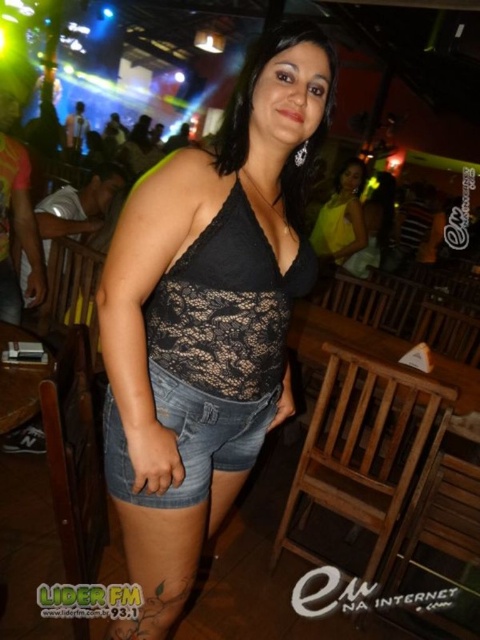
You are at a bar and want to take a photo of the woman in the center. The camera you are using has a focus point at coordinate [189,438]. What part of her outfit will be in focus?

The point at coordinate [189,438] marks the denim shorts at center, so the denim shorts at center will be in focus.

You are a photographer trying to capture a clear shot of both the denim shorts at center and the yellow satin dress at center. Since the camera can only focus on one subject at a time, which one should you choose to ensure the other is still somewhat visible?

The denim shorts at center is in front of the yellow satin dress at center, so you should focus on the denim shorts at center to ensure the yellow satin dress at center is still somewhat visible behind it.

You are standing at the center of the bar and see two points marked in the image. Which point is closer to you, point (200, 444) or point (237, 410)?

Point (200, 444) is in front of point (237, 410), so it is closer to you.